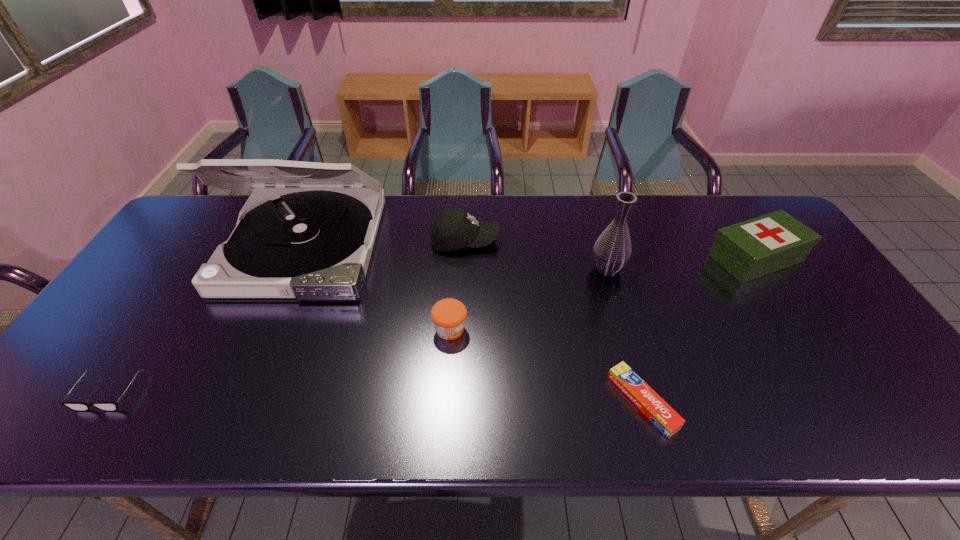
Identify the location of toothpaste at the near edge. The width and height of the screenshot is (960, 540). click(x=660, y=413).

Identify the location of object at the left edge. (75, 406).

Where is `object at the right edge`? object at the right edge is located at coordinates (754, 248).

Locate an element on the screen. The width and height of the screenshot is (960, 540). object located in the near left corner section of the desktop is located at coordinates (75, 406).

Locate an element on the screen. Image resolution: width=960 pixels, height=540 pixels. object positioned at the far right corner is located at coordinates (754, 248).

In the image, there is a desktop. Where is `free space at the far edge`? free space at the far edge is located at coordinates (720, 221).

Locate an element on the screen. blank space at the near edge of the desktop is located at coordinates (154, 403).

The width and height of the screenshot is (960, 540). In the image, there is a desktop. Identify the location of vacant space at the left edge. (178, 302).

Locate an element on the screen. vacant area at the far right corner is located at coordinates (738, 201).

The height and width of the screenshot is (540, 960). Find the location of `vacant area that lies between the toothpaste and the spectacles`. vacant area that lies between the toothpaste and the spectacles is located at coordinates (375, 397).